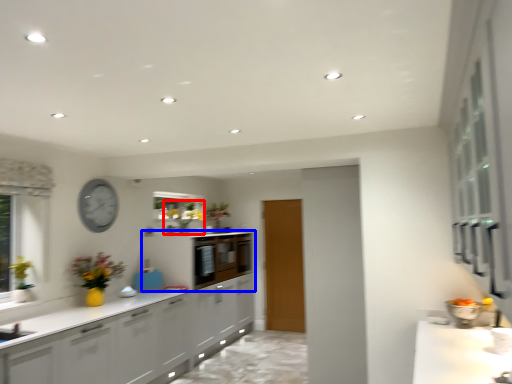
Question: Which of the following is the closest to the observer, floral arrangement (highlighted by a red box) or cabinetry (highlighted by a blue box)?

Choices:
 (A) floral arrangement
 (B) cabinetry

Answer: (A)